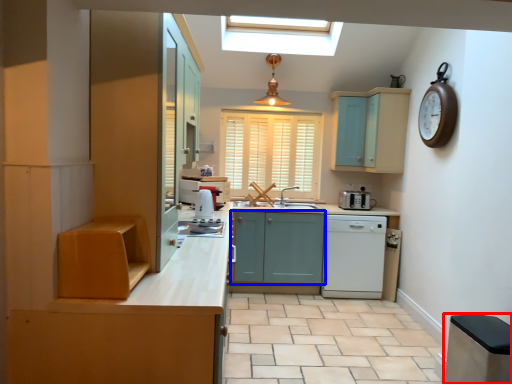
Question: Which object appears closest to the camera in this image, cabinetry (highlighted by a red box) or cabinetry (highlighted by a blue box)?

Choices:
 (A) cabinetry
 (B) cabinetry

Answer: (A)